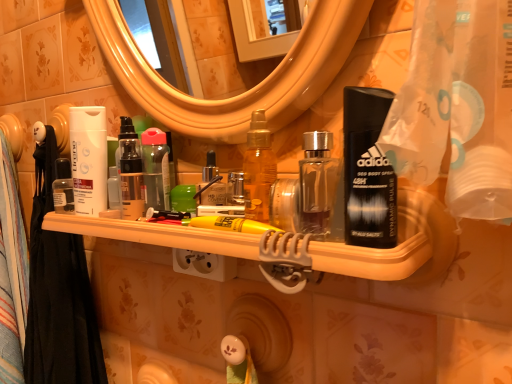
Question: Are white matte lotion at left and black fabric shower curtain at left located far from each other?

Choices:
 (A) yes
 (B) no

Answer: (B)

Question: Does white matte lotion at left turn towards black fabric shower curtain at left?

Choices:
 (A) yes
 (B) no

Answer: (B)

Question: Considering the relative positions of white matte lotion at left and black fabric shower curtain at left in the image provided, is white matte lotion at left to the left of black fabric shower curtain at left from the viewer's perspective?

Choices:
 (A) no
 (B) yes

Answer: (A)

Question: Is black fabric shower curtain at left at the back of white matte lotion at left?

Choices:
 (A) yes
 (B) no

Answer: (B)

Question: Considering the relative sizes of white matte lotion at left and black fabric shower curtain at left in the image provided, is white matte lotion at left smaller than black fabric shower curtain at left?

Choices:
 (A) no
 (B) yes

Answer: (B)

Question: Considering the positions of white matte lotion at left and translucent plastic shelf at center in the image, is white matte lotion at left bigger or smaller than translucent plastic shelf at center?

Choices:
 (A) small
 (B) big

Answer: (A)

Question: Considering the positions of point (93, 206) and point (333, 256), is point (93, 206) closer or farther from the camera than point (333, 256)?

Choices:
 (A) closer
 (B) farther

Answer: (B)

Question: From a real-world perspective, is white matte lotion at left above or below translucent plastic shelf at center?

Choices:
 (A) below
 (B) above

Answer: (B)

Question: Is white matte lotion at left taller or shorter than translucent plastic shelf at center?

Choices:
 (A) tall
 (B) short

Answer: (A)

Question: In terms of width, does black fabric shower curtain at left look wider or thinner when compared to translucent plastic shelf at center?

Choices:
 (A) wide
 (B) thin

Answer: (B)

Question: Considering the positions of black fabric shower curtain at left and translucent plastic shelf at center in the image, is black fabric shower curtain at left taller or shorter than translucent plastic shelf at center?

Choices:
 (A) short
 (B) tall

Answer: (B)

Question: Based on their positions, is black fabric shower curtain at left located to the left or right of translucent plastic shelf at center?

Choices:
 (A) right
 (B) left

Answer: (B)

Question: From a real-world perspective, is black fabric shower curtain at left positioned above or below translucent plastic shelf at center?

Choices:
 (A) above
 (B) below

Answer: (B)

Question: From the image's perspective, is glossy plastic mirror at upper center located above or below transparent plastic bottle at center?

Choices:
 (A) below
 (B) above

Answer: (B)

Question: Based on their sizes in the image, would you say glossy plastic mirror at upper center is bigger or smaller than transparent plastic bottle at center?

Choices:
 (A) big
 (B) small

Answer: (A)